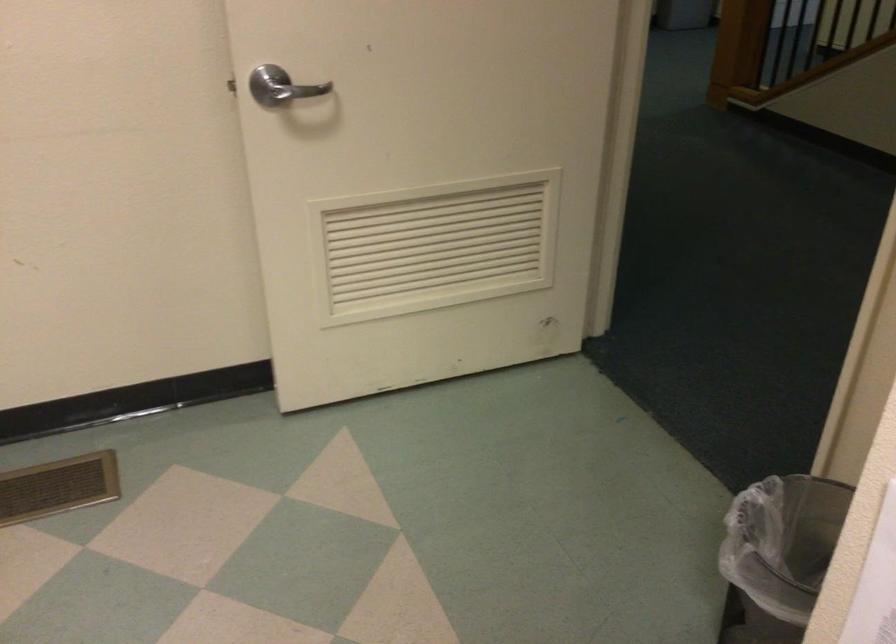
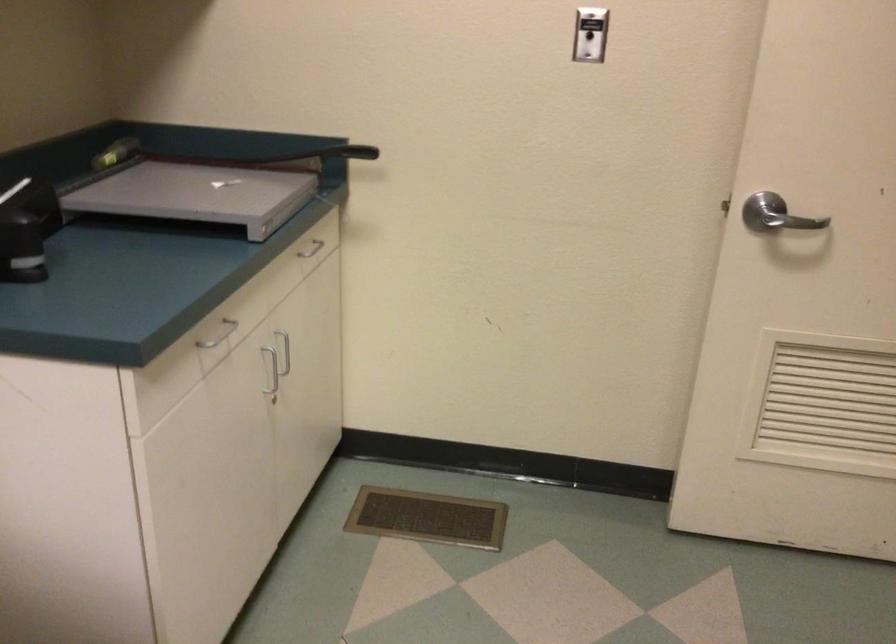
Question: The camera is either moving clockwise (left) or counter-clockwise (right) around the object. The first image is from the beginning of the video and the second image is from the end. Is the camera moving left or right when shooting the video?

Choices:
 (A) Left
 (B) Right

Answer: (B)